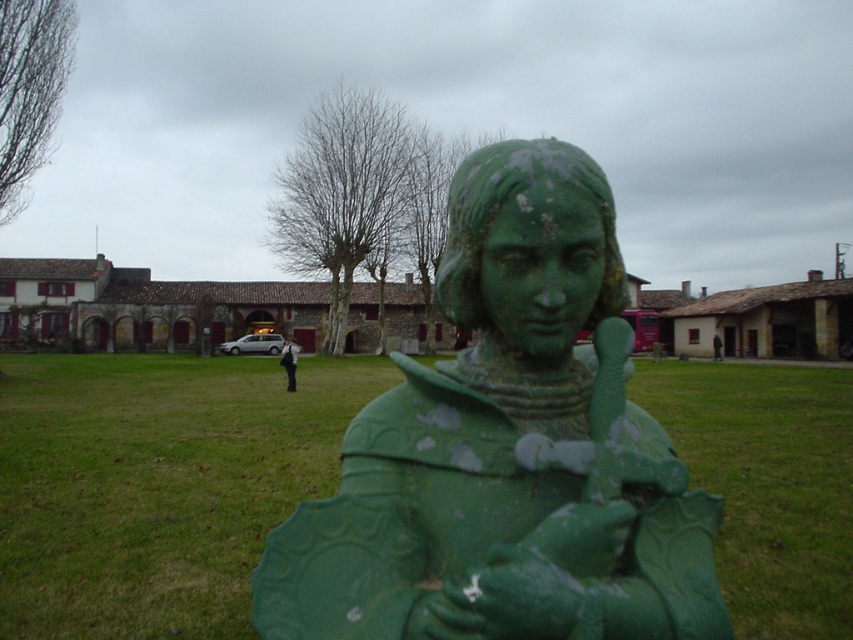
Is point (434, 492) in front of point (1, 621)?

Yes, point (434, 492) is closer to viewer.

Is green patinated metal statue at center wider than green painted metal statue at center?

In fact, green patinated metal statue at center might be narrower than green painted metal statue at center.

Does point (418, 388) lie in front of point (322, 488)?

Yes, it is.

Identify the location of green patinated metal statue at center. Image resolution: width=853 pixels, height=640 pixels. (503, 452).

Who is more forward, (141,609) or (289,355)?

Point (141,609) is in front.

Is green painted metal statue at center to the right of black fabric pants at center from the viewer's perspective?

Correct, you'll find green painted metal statue at center to the right of black fabric pants at center.

Find the location of `green painted metal statue at center`. green painted metal statue at center is located at coordinates (155, 484).

Is point (682, 500) farther from viewer compared to point (282, 358)?

No, it is not.

Is green patinated metal statue at center further to the viewer compared to black fabric pants at center?

No, green patinated metal statue at center is closer to the viewer.

Which is in front, point (587, 424) or point (293, 374)?

Point (587, 424) is in front.

Locate an element on the screen. The image size is (853, 640). green patinated metal statue at center is located at coordinates (503, 452).